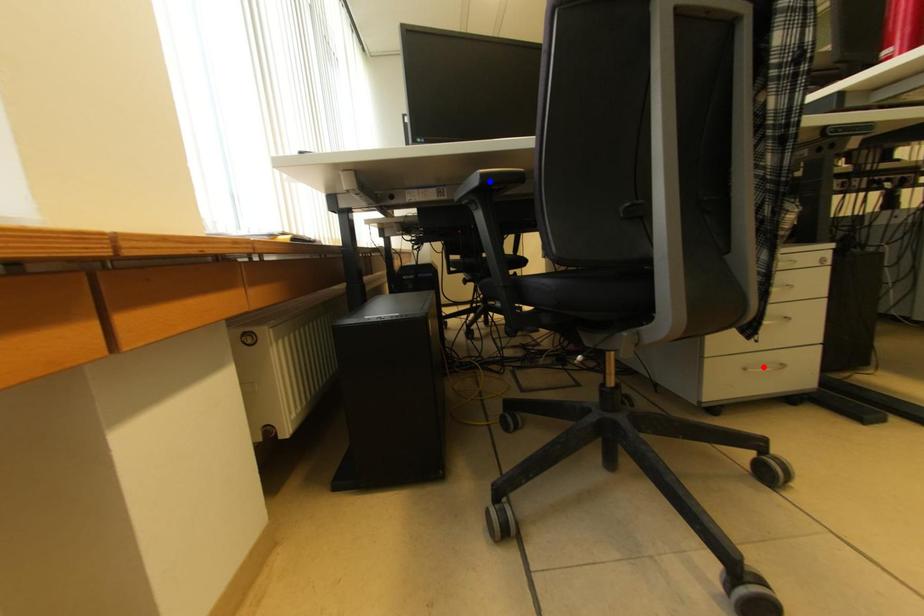
Question: In the image, two points are highlighted. Which point is nearer to the camera? Reply with the corresponding letter.

Choices:
 (A) blue point
 (B) red point

Answer: (A)